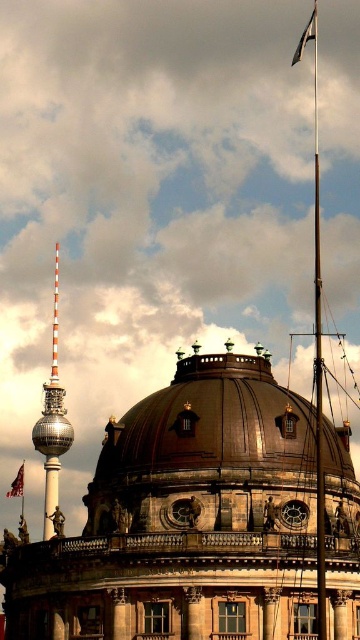
Is shiny gold dome at center behind metallic flag pole at upper center?

No, it is in front of metallic flag pole at upper center.

Between shiny gold dome at center and metallic flag pole at upper center, which one is positioned lower?

metallic flag pole at upper center is below.

Which is behind, point (249, 493) or point (20, 468)?

Point (20, 468)

Find the location of `shiny gold dome at center`. shiny gold dome at center is located at coordinates (203, 442).

Who is taller, shiny gold dome at center or white fabric flag at upper right?

Standing taller between the two is shiny gold dome at center.

Is shiny gold dome at center positioned before white fabric flag at upper right?

Yes, it is in front of white fabric flag at upper right.

Does point (293, 406) come behind point (309, 26)?

No, (293, 406) is in front of (309, 26).

Where is `shiny gold dome at center`? The image size is (360, 640). shiny gold dome at center is located at coordinates (203, 442).

Which of these two, shiny gold dome at center or red fabric flag at upper center, stands shorter?

With less height is red fabric flag at upper center.

Consider the image. Who is positioned more to the left, shiny gold dome at center or red fabric flag at upper center?

red fabric flag at upper center

Where is `shiny gold dome at center`? This screenshot has width=360, height=640. shiny gold dome at center is located at coordinates (203, 442).